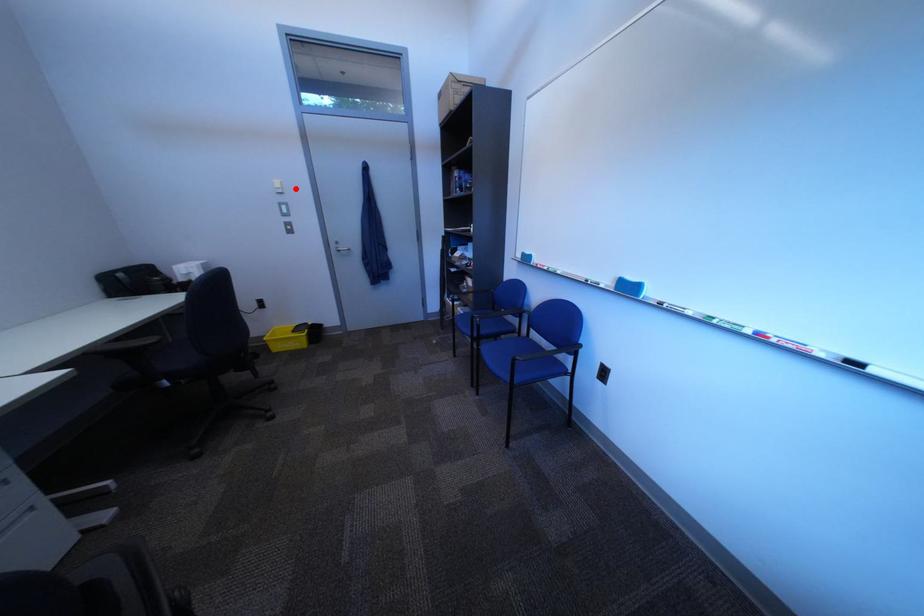
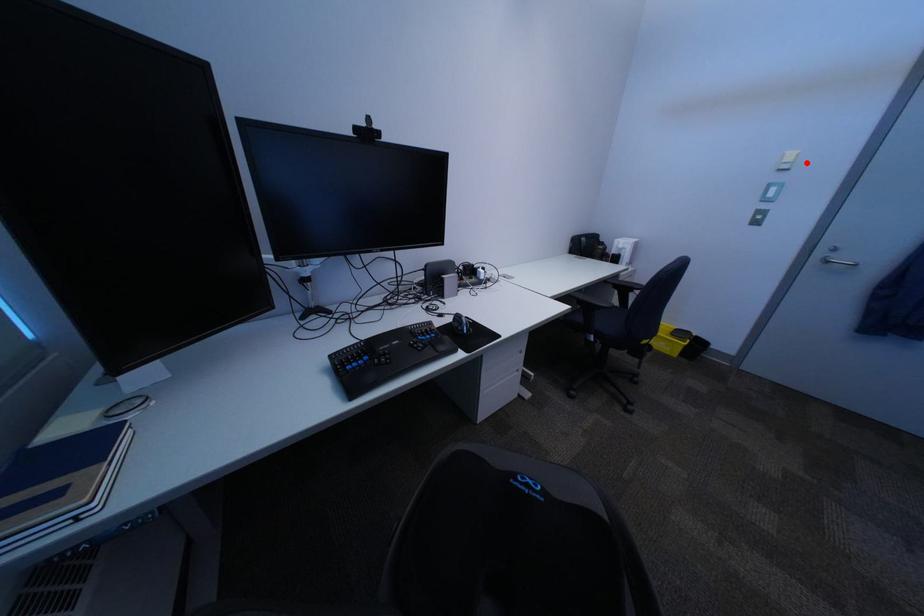
I am providing you with two images of the same scene from different viewpoints. A red point is marked on the first image and another point is marked on the second image. Is the red point in image1 aligned with the point shown in image2?

Yes